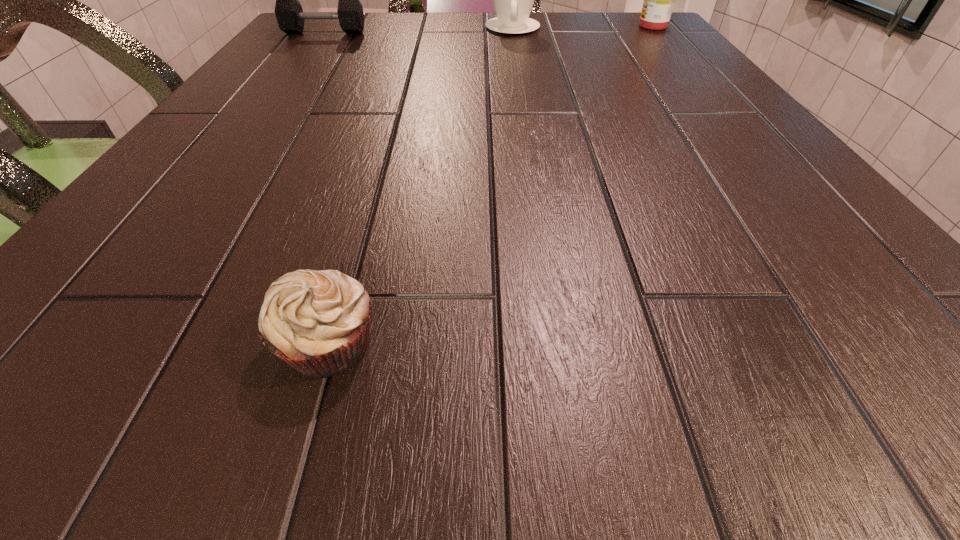
Locate an element on the screen. This screenshot has height=540, width=960. vacant space at the far edge of the desktop is located at coordinates (393, 14).

The image size is (960, 540). I want to click on free space at the near edge of the desktop, so click(483, 345).

This screenshot has width=960, height=540. I want to click on free space at the left edge of the desktop, so click(x=194, y=155).

In the image, there is a desktop. At what (x,y) coordinates should I click in order to perform the action: click on vacant space at the right edge. Please return your answer as a coordinate pair (x, y). This screenshot has width=960, height=540. Looking at the image, I should click on (656, 53).

Locate an element on the screen. Image resolution: width=960 pixels, height=540 pixels. free space between the leftmost object and the muffin is located at coordinates (326, 188).

Find the location of a particular element. The image size is (960, 540). free space between the rightmost object and the nearest object is located at coordinates (491, 185).

Locate an element on the screen. empty space that is in between the rightmost object and the dumbbell is located at coordinates (489, 30).

Find the location of `vacant area that lies between the leftmost object and the second object from right to left`. vacant area that lies between the leftmost object and the second object from right to left is located at coordinates (419, 31).

You are a GUI agent. You are given a task and a screenshot of the screen. Output one action in this format:
    pyautogui.click(x=<x>, y=<y>)
    Task: Click on the vacant space that's between the tallest object and the third object from left to right
    
    Given the screenshot: What is the action you would take?
    (583, 27)

This screenshot has width=960, height=540. Identify the location of unoccupied area between the leftmost object and the fruit juice. (489, 30).